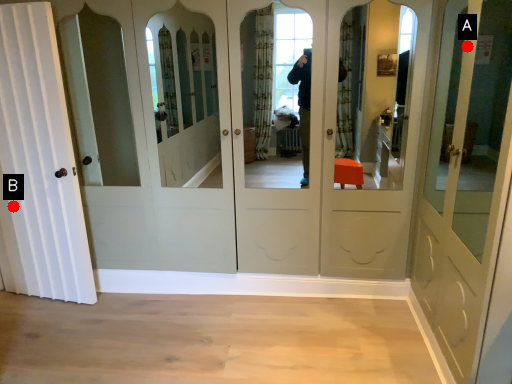
Question: Two points are circled on the image, labeled by A and B beside each circle. Which point is closer to the camera taking this photo?

Choices:
 (A) A is closer
 (B) B is closer

Answer: (A)